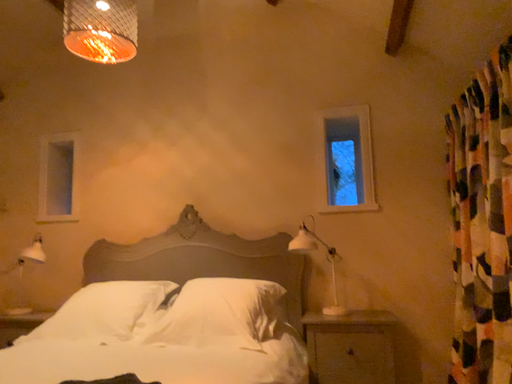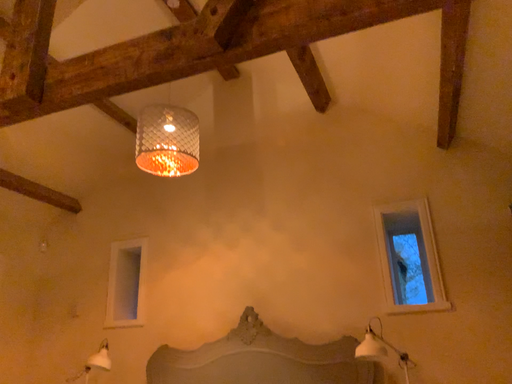
Question: How did the camera likely rotate when shooting the video?

Choices:
 (A) rotated left
 (B) rotated right

Answer: (A)